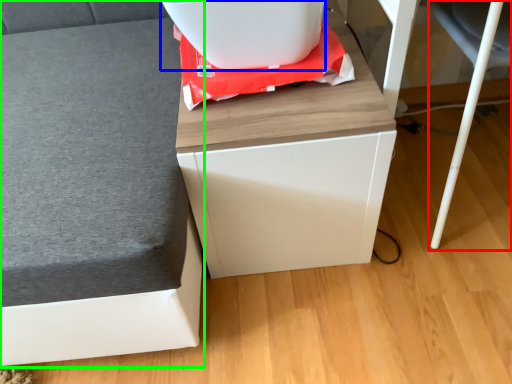
Question: Which object is positioned farthest from swivel chair (highlighted by a red box)? Select from appliance (highlighted by a blue box) and furniture (highlighted by a green box).

Choices:
 (A) appliance
 (B) furniture

Answer: (B)